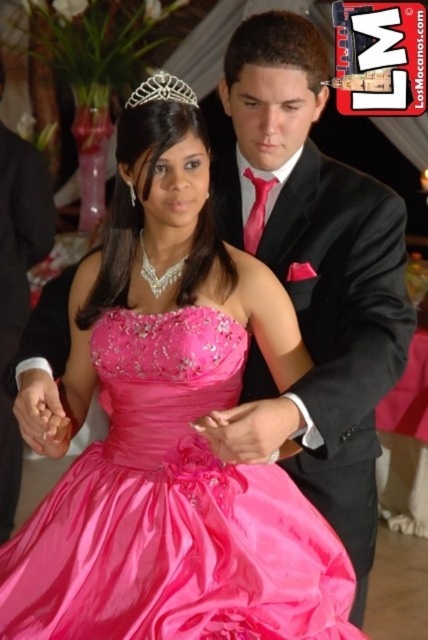
You are standing at the edge of the dance floor and want to reach a specific point marked at coordinates point (309,616). If you can walk 5 feet in 10 seconds, how long will it take you to reach that point?

The distance of point (309,616) from viewer is 4.92 feet. Since you can walk 5 feet in 10 seconds, it will take approximately 9.84 seconds to reach the point. Since you can walk 5 feet in 10 seconds, your speed is 0.5 feet per second. Dividing the distance by speed gives 4.92 feet divided by 0.5 feet per second equals 9.84 seconds.

From the picture: You are a photographer at the event and need to adjust your camera settings to capture both the shiny taffeta dress at center and the black satin suit at center clearly. Since the dress is more reflective, which object might require you to adjust the exposure settings to avoid overexposure?

The shiny taffeta dress at center is more reflective than the black satin suit at center, so adjusting the exposure settings for it would prevent overexposure.

You are a photographer at the event and want to capture a clear shot of the shiny taffeta dress at center and the black satin suit at center. Since both are at the center, which one will appear closer to the camera in the photo?

The shiny taffeta dress at center is in front of the black satin suit at center, so it will appear closer to the camera in the photo.